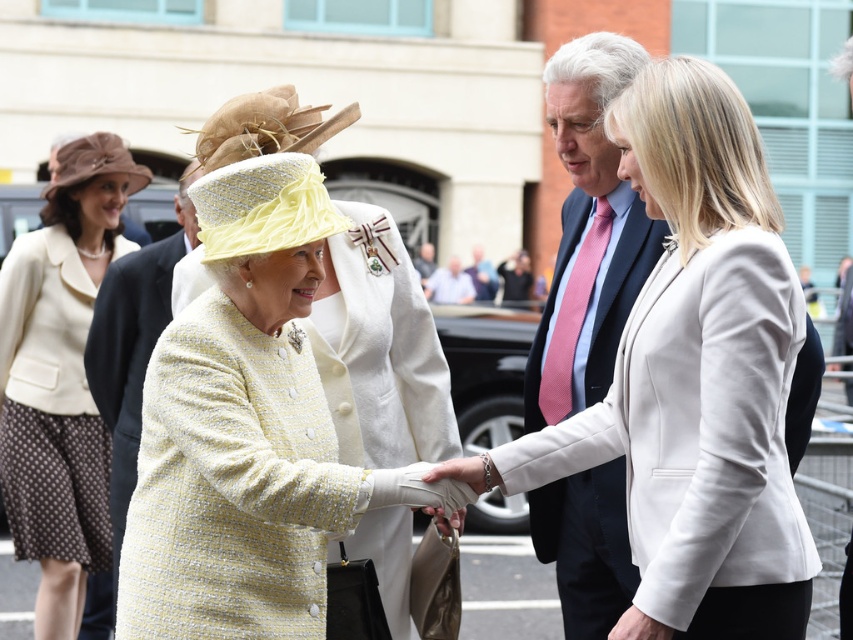
Which is above, light beige wool coat at left or light blue shirt at center?

Positioned higher is light blue shirt at center.

Is point (126, 273) farther from camera compared to point (428, 282)?

No, it is not.

In order to click on light beige wool coat at left in this screenshot , I will do pyautogui.click(x=128, y=374).

Consider the image. Is yellow fabric hat at center below light blue shirt at center?

Yes.

Is point (279, 195) more distant than point (439, 273)?

No, it is not.

Between point (253, 195) and point (430, 298), which one is positioned in front?

Point (253, 195) is more forward.

You are a GUI agent. You are given a task and a screenshot of the screen. Output one action in this format:
    pyautogui.click(x=<x>, y=<y>)
    Task: Click on the yellow fabric hat at center
    This screenshot has width=853, height=640.
    Given the screenshot: What is the action you would take?
    pyautogui.click(x=263, y=205)

Is brown felt hat at upper left positioned before light blue shirt at center?

Yes.

Which is below, brown felt hat at upper left or light blue shirt at center?

light blue shirt at center is lower down.

Identify the location of brown felt hat at upper left. (96, 163).